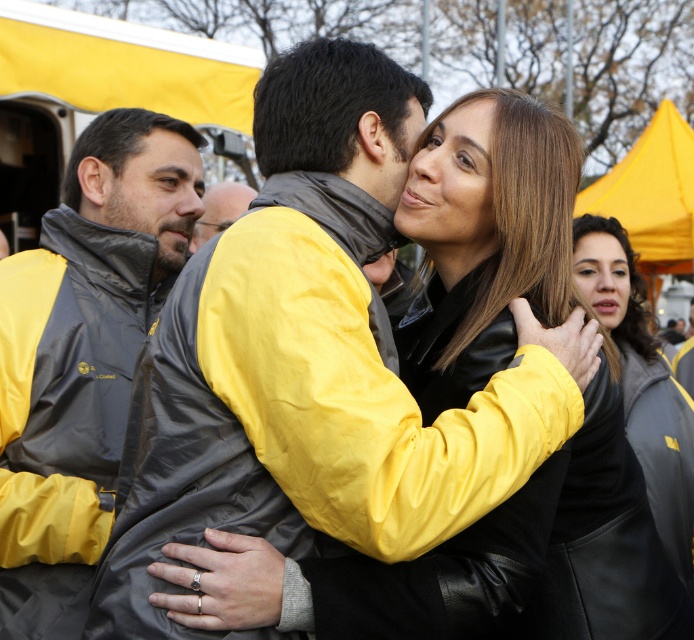
You are a photographer at the event and need to adjust your camera settings to focus on both the black leather jacket at center and the yellow matte jacket at center. Which jacket should you focus on first to ensure both are in focus, considering their positions?

A: The black leather jacket at center is located below the yellow matte jacket at center. To ensure both are in focus, you should focus on the yellow matte jacket at center first since it is higher up and closer to the camera, allowing the depth of field to naturally include the lower positioned black leather jacket at center.

From the picture: You are a photographer at the event and want to ensure both the matte black jacket at left and the black leather jacket at center are clearly visible in the next shot. Given their heights, which jacket should you focus on first to ensure proper framing?

The matte black jacket at left is much taller than the black leather jacket at center, so you should focus on the matte black jacket at left first to account for its height in the frame.

Consider the image. You are organizing a clothing display and need to place the matte black jacket at left and the yellow matte jacket at center on a shelf. Given their widths, which jacket should be placed on the left side of the shelf to ensure they fit properly?

The matte black jacket at left should be placed on the left side of the shelf since it is wider than the yellow matte jacket at center, allowing both to fit properly without overcrowding.